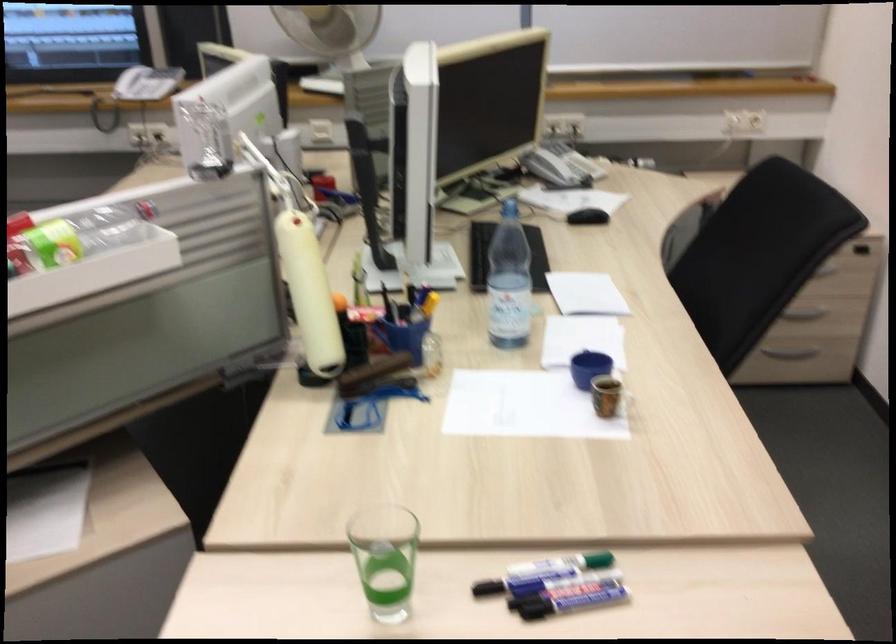
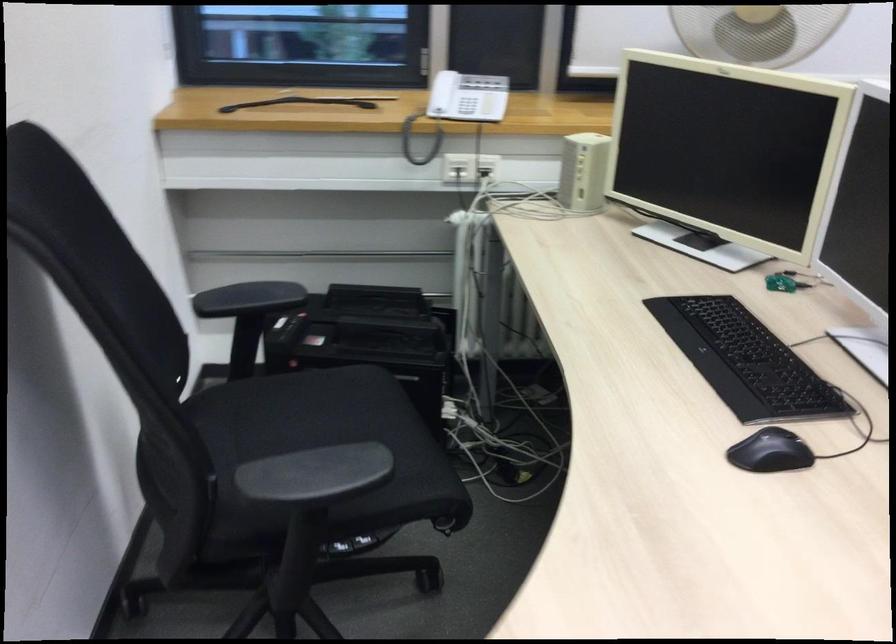
What movement of the cameraman would produce the second image?

The cameraman moved toward left, forward.